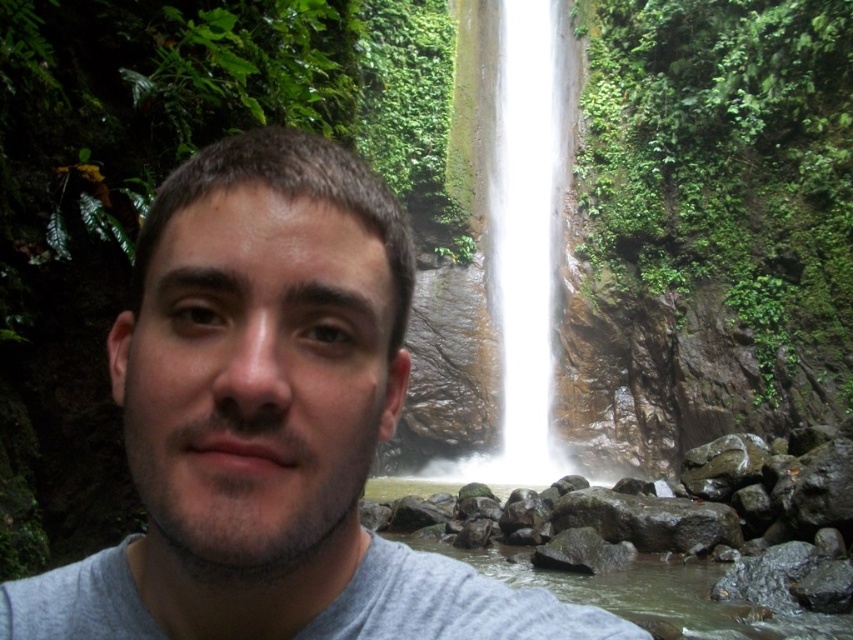
You are a photographer trying to capture the white smooth waterfall at center in your shot. However, the gray cotton shirt at center is blocking part of the waterfall. Can you adjust your position to fully frame the waterfall without the shirt obscuring it?

The gray cotton shirt at center is not as tall as the white smooth waterfall at center, so you can adjust your position to look above the shirt to fully frame the white smooth waterfall at center without obstruction.

You are a photographer planning to take a portrait of the person wearing the gray cotton shirt at center. You want to ensure the white smooth waterfall at center is visible in the background. Given that your camera has a maximum focus range of 50 meters, will you be able to capture both the shirt and the waterfall clearly in the same photo?

The distance between the gray cotton shirt at center and the white smooth waterfall at center is 47.76 meters. Since the camera can focus up to 50 meters, the photographer can capture both the shirt and the waterfall clearly as the distance is within the camera range.

You are standing at the base of the waterfall in the image and want to reach the point marked as point (451, 605). Given that the distance between you and the point is 16.21 meters, can you safely walk to that point if your maximum comfortable walking distance is 15 meters?

The distance between you and point (451, 605) is 16.21 meters, which exceeds your maximum comfortable walking distance of 15 meters. Therefore, it is not safe to walk to that point.